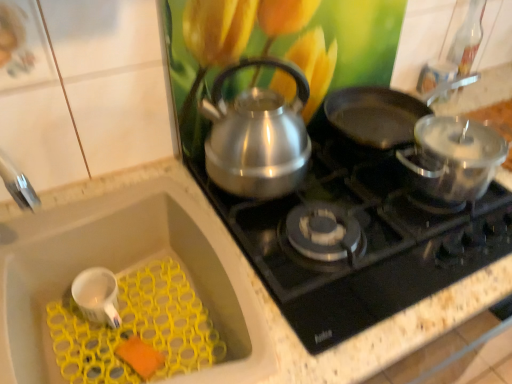
At what (x,y) coordinates should I click in order to perform the action: click on polished stainless steel kettle at upper center. Please return your answer as a coordinate pair (x, y). This screenshot has height=384, width=512. Looking at the image, I should click on (366, 239).

Locate an element on the screen. The height and width of the screenshot is (384, 512). shiny black frying pan at upper right is located at coordinates (383, 112).

In order to click on satin silver kettle at center in this screenshot , I will do `click(257, 136)`.

The width and height of the screenshot is (512, 384). Describe the element at coordinates (257, 136) in the screenshot. I see `satin silver kettle at center` at that location.

Measure the distance between point [180,259] and camera.

The distance of point [180,259] from camera is 36.89 inches.

The height and width of the screenshot is (384, 512). What are the coordinates of `polished stainless steel kettle at upper center` in the screenshot? It's located at (366, 239).

From a real-world perspective, is satin silver kettle at center over white matte sink at lower left?

Yes, from a real-world perspective, satin silver kettle at center is above white matte sink at lower left.

Is satin silver kettle at center turned away from white matte sink at lower left?

No, white matte sink at lower left is not at the back of satin silver kettle at center.

Who is bigger, satin silver kettle at center or white matte sink at lower left?

white matte sink at lower left is bigger.

In the image, is satin silver kettle at center on the left side or the right side of white matte sink at lower left?

satin silver kettle at center is positioned on white matte sink at lower left's right side.

Looking at the image, does polished stainless steel kettle at upper center seem bigger or smaller compared to satin silver kettle at center?

polished stainless steel kettle at upper center is bigger than satin silver kettle at center.

Does point (405, 257) lie behind point (238, 189)?

No.

How distant is polished stainless steel kettle at upper center from satin silver kettle at center?

polished stainless steel kettle at upper center and satin silver kettle at center are 6.60 inches apart.

Between polished stainless steel kettle at upper center and satin silver kettle at center, which one has larger width?

polished stainless steel kettle at upper center.

Which is in front, point (141, 205) or point (381, 101)?

The point (141, 205) is in front.

Does white matte sink at lower left have a lesser height compared to shiny black frying pan at upper right?

No.

From the image's perspective, is white matte sink at lower left above or below shiny black frying pan at upper right?

white matte sink at lower left is situated lower than shiny black frying pan at upper right in the image.

How many degrees apart are the facing directions of white matte sink at lower left and shiny black frying pan at upper right?

white matte sink at lower left and shiny black frying pan at upper right are facing 0.712 degrees away from each other.

Is white matte sink at lower left facing away from white matte mug at lower left?

Yes, white matte sink at lower left is positioned with its back facing white matte mug at lower left.

Considering the sizes of objects white matte sink at lower left and white matte mug at lower left in the image provided, who is shorter, white matte sink at lower left or white matte mug at lower left?

With less height is white matte mug at lower left.

Considering the relative sizes of white matte sink at lower left and white matte mug at lower left in the image provided, is white matte sink at lower left bigger than white matte mug at lower left?

Yes.

Is white matte sink at lower left in front of or behind white matte mug at lower left in the image?

Clearly, white matte sink at lower left is in front of white matte mug at lower left.

Is white matte mug at lower left placed right next to polished stainless steel kettle at upper center?

white matte mug at lower left and polished stainless steel kettle at upper center are not in contact.

Is white matte mug at lower left at the left side of polished stainless steel kettle at upper center?

Yes, white matte mug at lower left is to the left of polished stainless steel kettle at upper center.

Considering the relative sizes of white matte mug at lower left and polished stainless steel kettle at upper center in the image provided, is white matte mug at lower left smaller than polished stainless steel kettle at upper center?

Yes.

From a real-world perspective, which object rests below the other?

In real-world perspective, shiny black frying pan at upper right is lower.

Is shiny black frying pan at upper right wider or thinner than satin silver kettle at center?

In the image, shiny black frying pan at upper right appears to be wider than satin silver kettle at center.

From the image's perspective, which one is positioned lower, shiny black frying pan at upper right or satin silver kettle at center?

satin silver kettle at center, from the image's perspective.

Locate an element on the screen. This screenshot has width=512, height=384. kettle that is on the left side of shiny black frying pan at upper right is located at coordinates 257,136.

Is point (114, 323) positioned after point (85, 248)?

No, it is in front of (85, 248).

Can you confirm if white matte mug at lower left is taller than white matte sink at lower left?

In fact, white matte mug at lower left may be shorter than white matte sink at lower left.

From the image's perspective, is white matte mug at lower left located above or below white matte sink at lower left?

From the image's perspective, white matte mug at lower left appears above white matte sink at lower left.

In the image, there is a satin silver kettle at center. Where is `sink below it (from a real-world perspective)`? sink below it (from a real-world perspective) is located at coordinates (121, 270).

This screenshot has width=512, height=384. I want to click on gas stove on the right of satin silver kettle at center, so click(366, 239).

When comparing their distances from white matte sink at lower left, does satin silver kettle at center or polished stainless steel kettle at upper center seem further?

polished stainless steel kettle at upper center.

Looking at the image, which one is located closer to shiny black frying pan at upper right, satin silver kettle at center or polished stainless steel kettle at upper center?

polished stainless steel kettle at upper center is closer to shiny black frying pan at upper right.

Estimate the real-world distances between objects in this image. Which object is further from polished stainless steel kettle at upper center, white matte sink at lower left or satin silver kettle at center?

white matte sink at lower left is further to polished stainless steel kettle at upper center.

Based on the photo, from the image, which object appears to be farther from satin silver kettle at center, white matte sink at lower left or polished stainless steel kettle at upper center?

white matte sink at lower left is further to satin silver kettle at center.

From the image, which object appears to be nearer to polished stainless steel kettle at upper center, white matte sink at lower left or shiny black frying pan at upper right?

shiny black frying pan at upper right is positioned closer to the anchor polished stainless steel kettle at upper center.

Looking at the image, which one is located further to shiny black frying pan at upper right, polished stainless steel kettle at upper center or satin silver kettle at center?

The object further to shiny black frying pan at upper right is satin silver kettle at center.

Estimate the real-world distances between objects in this image. Which object is further from white matte sink at lower left, polished stainless steel kettle at upper center or shiny black frying pan at upper right?

shiny black frying pan at upper right is positioned further to the anchor white matte sink at lower left.

Considering their positions, is white matte mug at lower left positioned closer to polished stainless steel kettle at upper center than white matte sink at lower left?

white matte sink at lower left is closer to polished stainless steel kettle at upper center.

Find the location of a particular element. sink located between white matte mug at lower left and shiny black frying pan at upper right in the left-right direction is located at coordinates (121, 270).

Identify the location of gas stove situated between satin silver kettle at center and shiny black frying pan at upper right from left to right. (366, 239).

This screenshot has height=384, width=512. I want to click on sink between white matte mug at lower left and polished stainless steel kettle at upper center, so click(x=121, y=270).

Where is `appliance between satin silver kettle at center and white matte sink at lower left in the vertical direction`? appliance between satin silver kettle at center and white matte sink at lower left in the vertical direction is located at coordinates (97, 296).